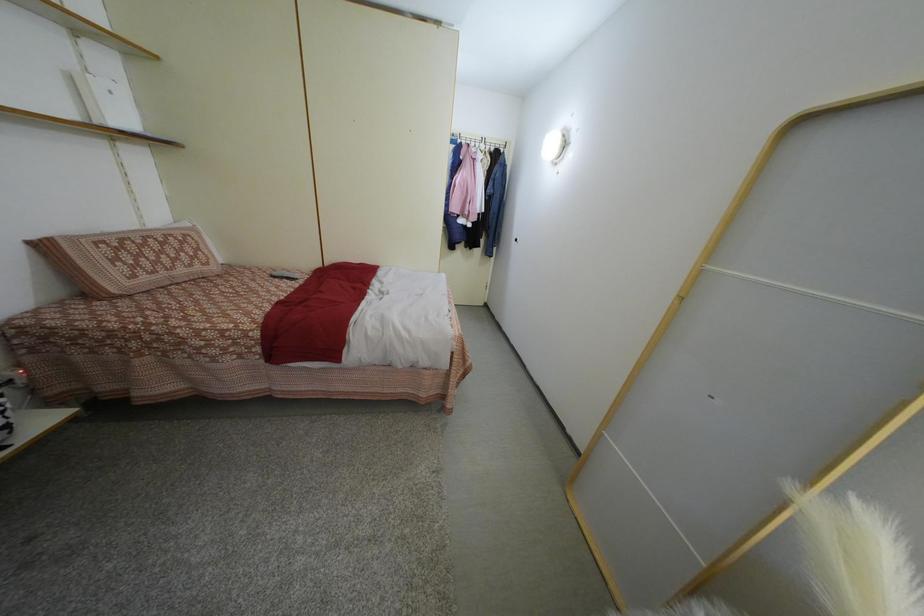
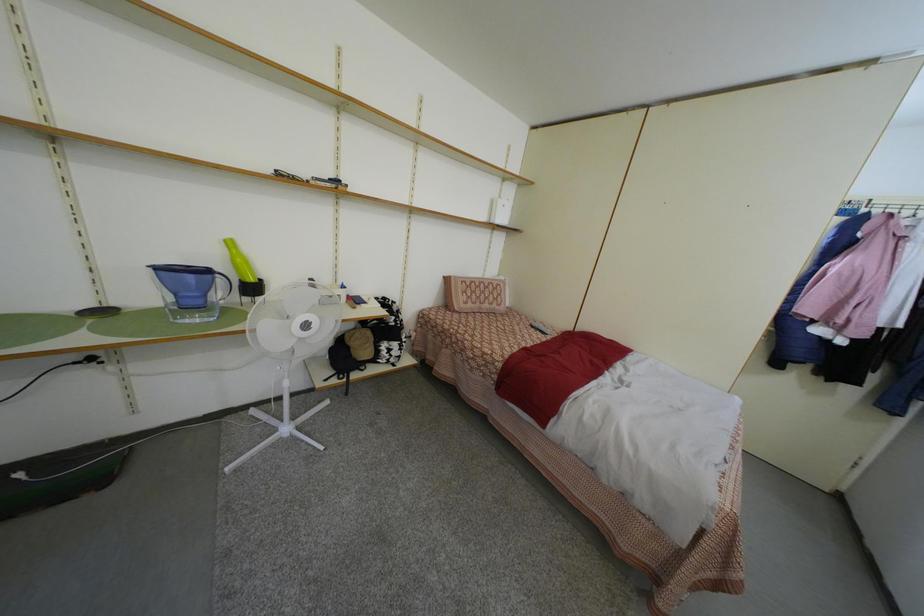
Question: The camera is either moving clockwise (left) or counter-clockwise (right) around the object. The first image is from the beginning of the video and the second image is from the end. Is the camera moving left or right when shooting the video?

Choices:
 (A) Left
 (B) Right

Answer: (B)